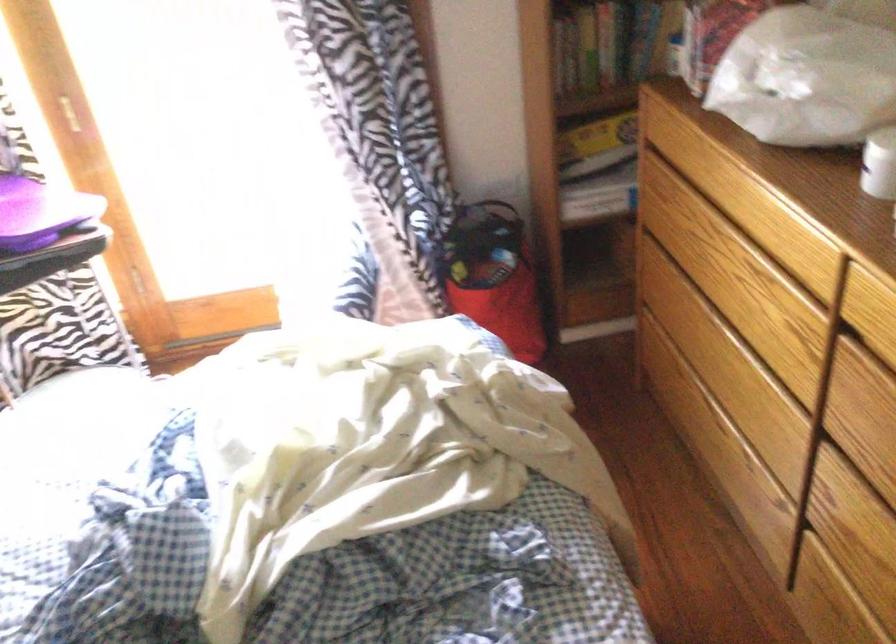
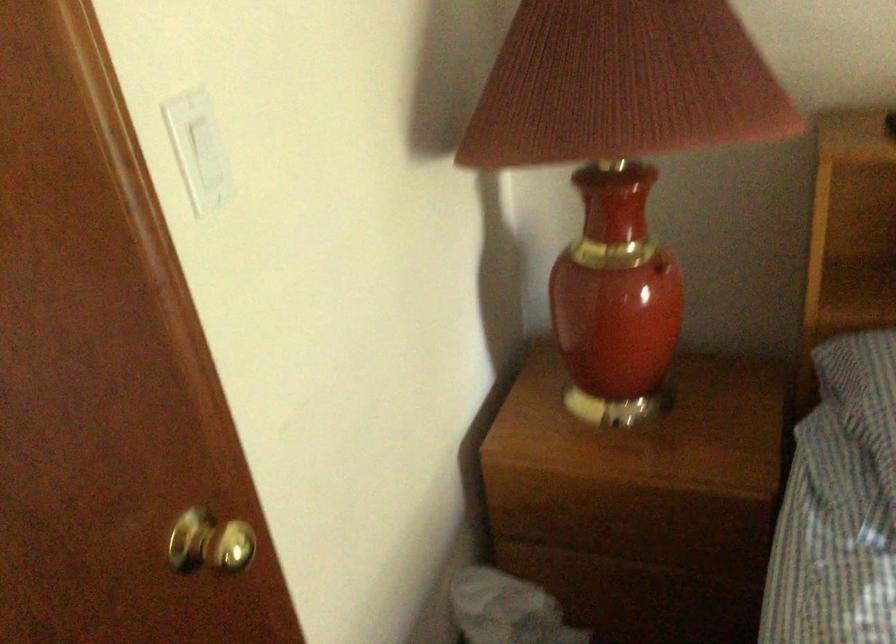
The first image is from the beginning of the video and the second image is from the end. How did the camera likely rotate when shooting the video?

The camera rotated toward left-down.